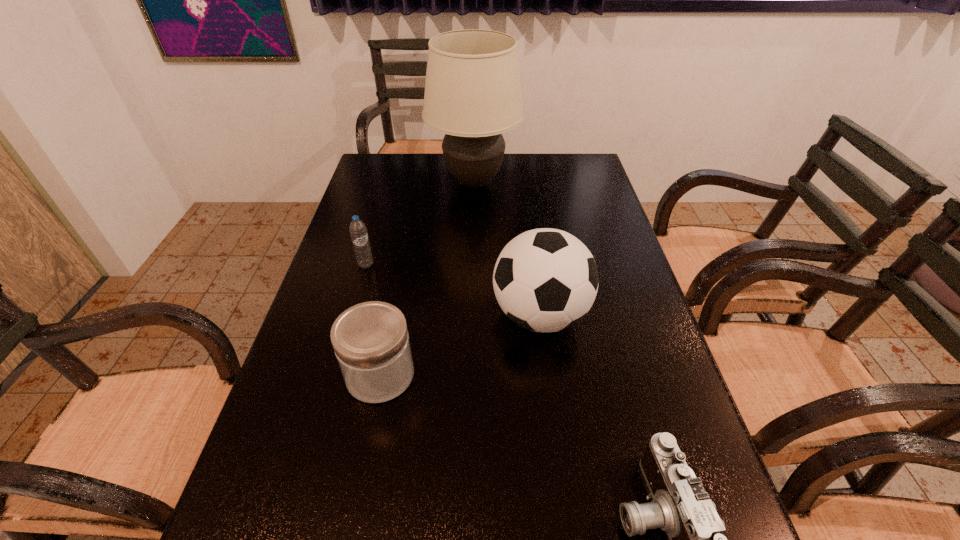
The height and width of the screenshot is (540, 960). I want to click on lampshade, so click(x=473, y=94).

This screenshot has width=960, height=540. Find the location of `the farthest object`. the farthest object is located at coordinates (473, 94).

I want to click on the fourth shortest object, so click(x=545, y=280).

Locate an element on the screen. This screenshot has width=960, height=540. water bottle is located at coordinates (358, 231).

At what (x,y) coordinates should I click in order to perform the action: click on the leftmost object. Please return your answer as a coordinate pair (x, y). This screenshot has height=540, width=960. Looking at the image, I should click on (358, 231).

Where is `jar`? The height and width of the screenshot is (540, 960). jar is located at coordinates (371, 342).

Where is `vacant space located on the right of the farthest object`? This screenshot has height=540, width=960. vacant space located on the right of the farthest object is located at coordinates (548, 183).

The image size is (960, 540). What are the coordinates of `free location located 0.330m on the back of the soccer ball` in the screenshot? It's located at (526, 211).

Locate an element on the screen. The height and width of the screenshot is (540, 960). free location located on the front of the second farthest object is located at coordinates (354, 305).

I want to click on vacant space located 0.080m on the back of the jar, so click(x=391, y=321).